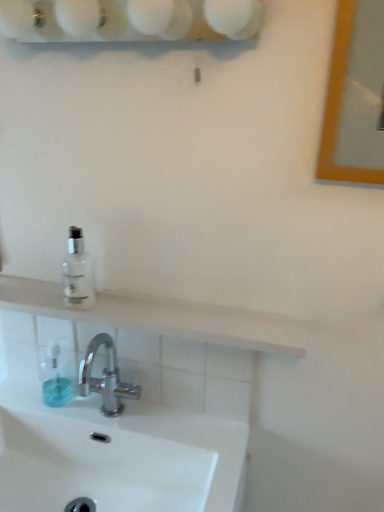
Question: From the image's perspective, is transparent plastic soap dispenser at lower left below white matte shelf at upper center?

Choices:
 (A) no
 (B) yes

Answer: (B)

Question: From a real-world perspective, is transparent plastic soap dispenser at lower left physically below white matte shelf at upper center?

Choices:
 (A) no
 (B) yes

Answer: (B)

Question: From the image's perspective, is transparent plastic soap dispenser at lower left on white matte shelf at upper center?

Choices:
 (A) no
 (B) yes

Answer: (A)

Question: Does transparent plastic soap dispenser at lower left have a lesser width compared to white matte shelf at upper center?

Choices:
 (A) no
 (B) yes

Answer: (B)

Question: Is transparent plastic soap dispenser at lower left positioned with its back to white matte shelf at upper center?

Choices:
 (A) no
 (B) yes

Answer: (A)

Question: From their relative heights in the image, would you say wooden frame mirror at upper right is taller or shorter than white glossy shelf at upper center?

Choices:
 (A) short
 (B) tall

Answer: (B)

Question: Is wooden frame mirror at upper right wider or thinner than white glossy shelf at upper center?

Choices:
 (A) thin
 (B) wide

Answer: (A)

Question: Considering the positions of point coord(374,114) and point coord(218,9), is point coord(374,114) closer or farther from the camera than point coord(218,9)?

Choices:
 (A) farther
 (B) closer

Answer: (A)

Question: Is wooden frame mirror at upper right inside the boundaries of white glossy shelf at upper center, or outside?

Choices:
 (A) outside
 (B) inside

Answer: (A)

Question: From a real-world perspective, relative to transparent plastic soap dispenser at lower left, is transparent glass bottle at upper left vertically above or below?

Choices:
 (A) below
 (B) above

Answer: (B)

Question: In terms of height, does transparent glass bottle at upper left look taller or shorter compared to transparent plastic soap dispenser at lower left?

Choices:
 (A) short
 (B) tall

Answer: (B)

Question: Is transparent glass bottle at upper left bigger or smaller than transparent plastic soap dispenser at lower left?

Choices:
 (A) small
 (B) big

Answer: (B)

Question: In the image, is transparent glass bottle at upper left positioned in front of or behind transparent plastic soap dispenser at lower left?

Choices:
 (A) behind
 (B) front

Answer: (B)

Question: From a real-world perspective, is transparent glass bottle at upper left above or below wooden frame mirror at upper right?

Choices:
 (A) above
 (B) below

Answer: (B)

Question: Is transparent glass bottle at upper left to the left or to the right of wooden frame mirror at upper right in the image?

Choices:
 (A) left
 (B) right

Answer: (A)